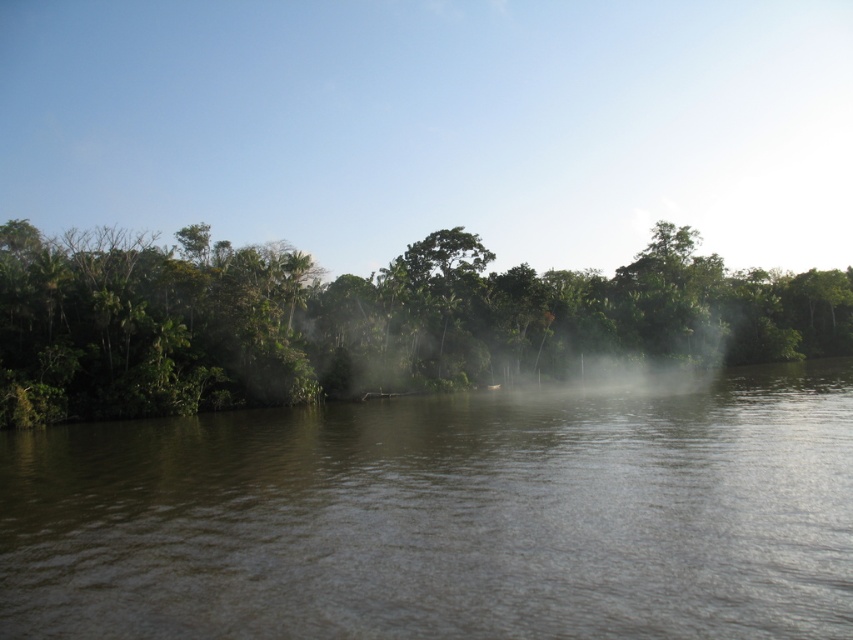
Can you confirm if brown murky water at center is bigger than green leafy trees at center?

No, brown murky water at center is not bigger than green leafy trees at center.

Consider the image. Who is more forward, (9, 436) or (48, 413)?

Positioned in front is point (9, 436).

Identify the location of brown murky water at center. (445, 515).